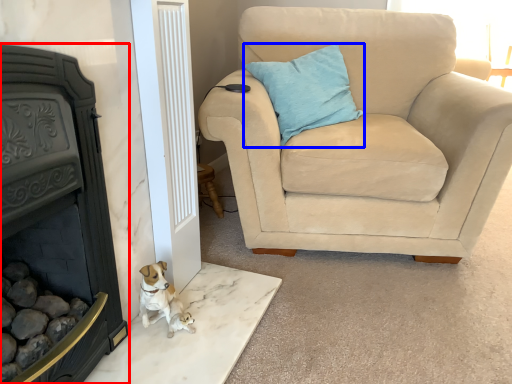
Question: Which object is closer to the camera taking this photo, fireplace (highlighted by a red box) or pillow (highlighted by a blue box)?

Choices:
 (A) fireplace
 (B) pillow

Answer: (A)